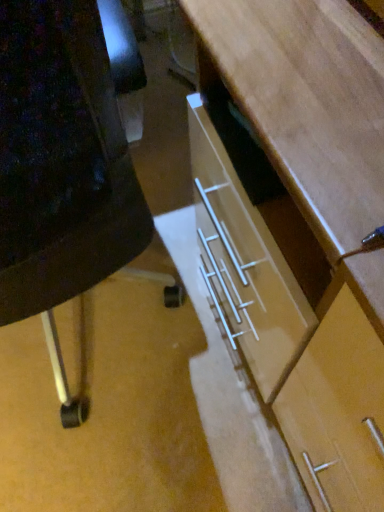
Find the location of a particular element. Image resolution: width=384 pixels, height=512 pixels. vacant space underneath white plastic drawer at lower center (from a real-world perspective) is located at coordinates (94, 356).